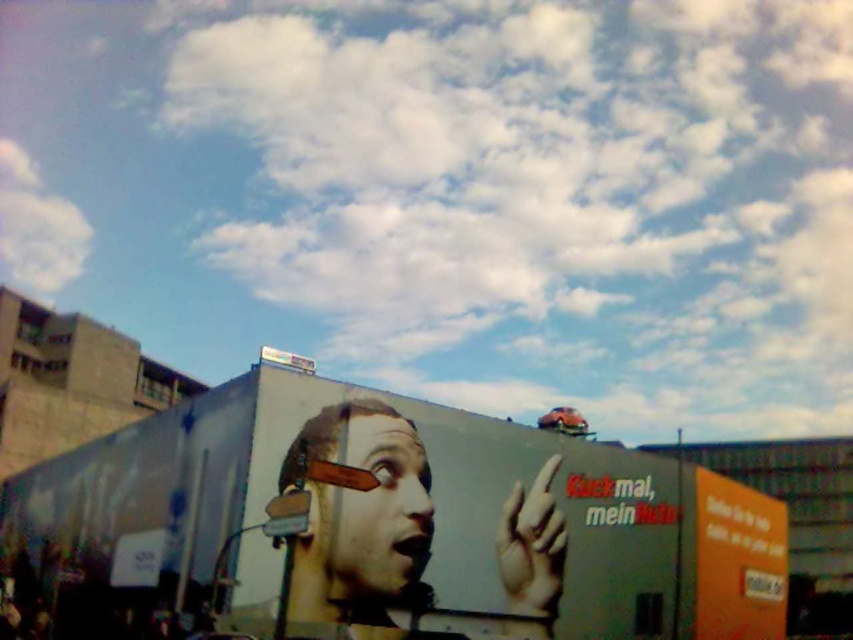
Does matte gray billboard at center appear on the left side of smooth skin face at center?

Incorrect, matte gray billboard at center is not on the left side of smooth skin face at center.

Who is more distant from viewer, (482,621) or (390,497)?

Point (482,621)

The width and height of the screenshot is (853, 640). Identify the location of matte gray billboard at center. (463, 516).

Find the location of a particular element. orange matte billboard at lower right is located at coordinates (738, 561).

Does matte gray billboard at center appear on the right side of smooth beige hand at lower center?

No, matte gray billboard at center is not to the right of smooth beige hand at lower center.

Who is shorter, matte gray billboard at center or smooth beige hand at lower center?

smooth beige hand at lower center

This screenshot has width=853, height=640. What do you see at coordinates (463, 516) in the screenshot?
I see `matte gray billboard at center` at bounding box center [463, 516].

Locate an element on the screen. The width and height of the screenshot is (853, 640). matte gray billboard at center is located at coordinates (463, 516).